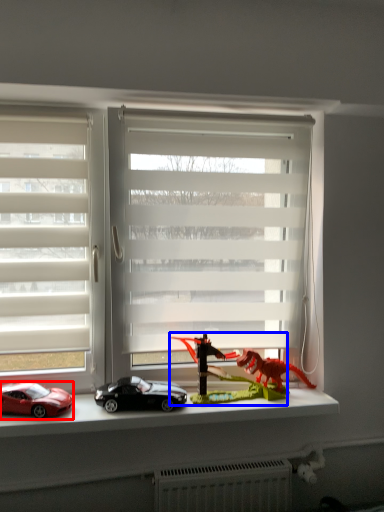
Question: Which point is closer to the camera, car (highlighted by a red box) or toy (highlighted by a blue box)?

Choices:
 (A) car
 (B) toy

Answer: (A)